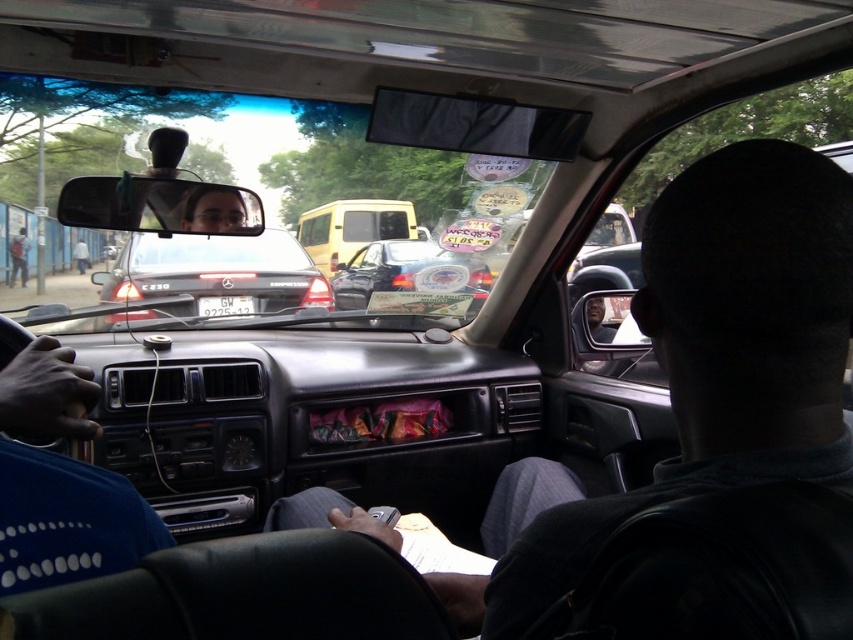
You are a passenger in the back seat of the car. You want to look at the white plastic license plate at center and the matte black car door at center. Which object is closer to you?

The white plastic license plate at center is closer to you because it is further to the viewer than the matte black car door at center.

You are a delivery driver who needs to attach a GPS tracker to your vehicle. The GPS tracker must be placed exactly 4 meters away from the white plastic license plate at center. Based on the scene, where could you place the GPS tracker?

The GPS tracker should be placed 4 meters away from the white plastic license plate at center. Since the white plastic license plate at center and camera are 3.80 meters apart, the GPS tracker needs to be placed 0.20 meters beyond the camera in the direction away from the license plate to achieve the required distance.